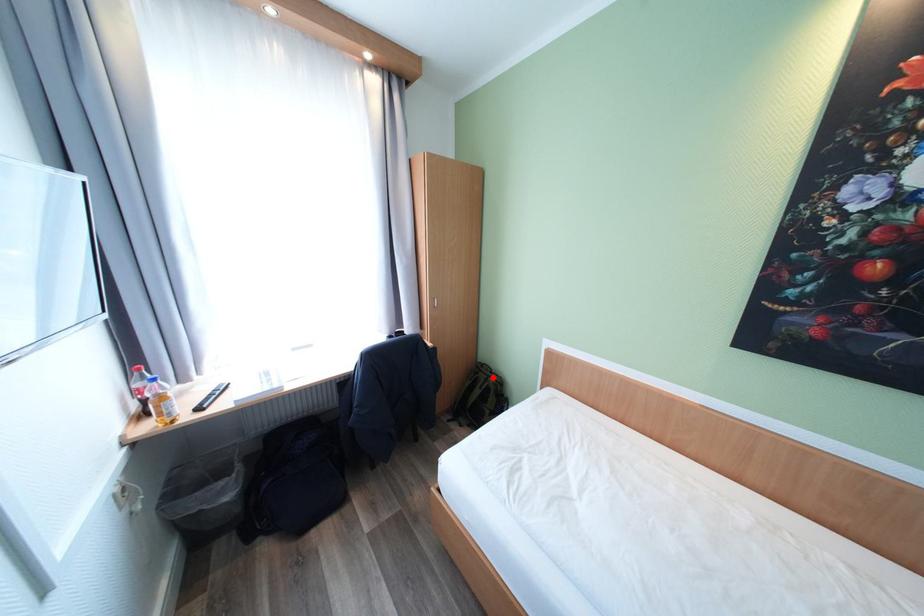
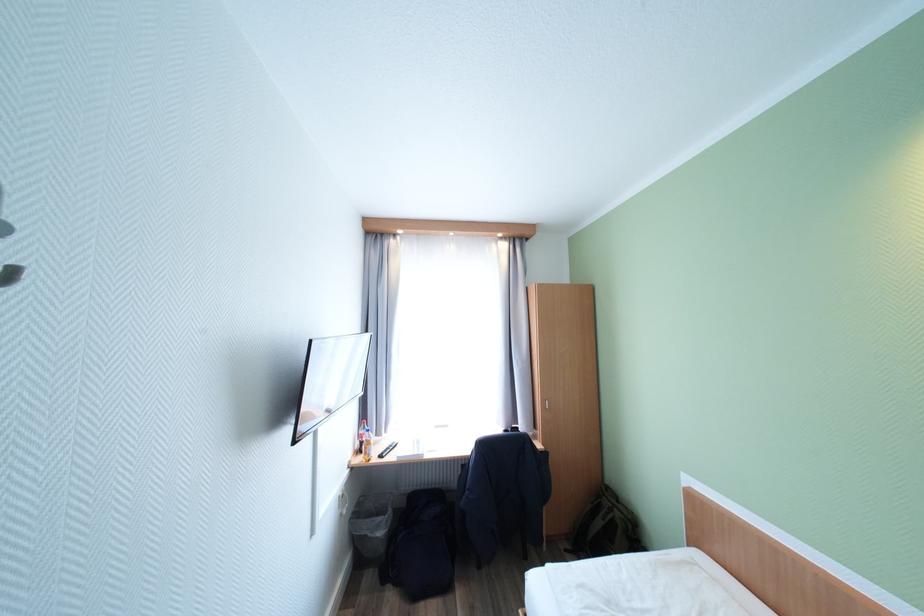
The point at the highlighted location is marked in the first image. Where is the corresponding point in the second image?

(617, 506)